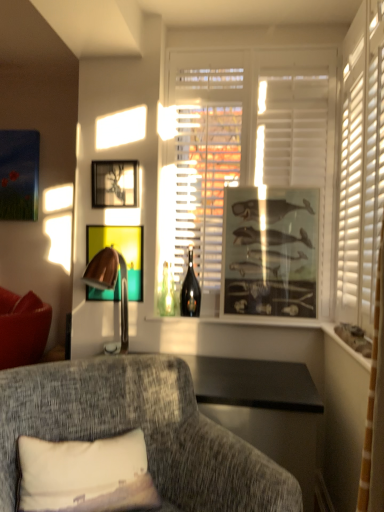
Image resolution: width=384 pixels, height=512 pixels. Find the location of `vacant space that is in between matte glass picture frame at center, the 3th picture frame when ordered from left to right, and shiny dark glass wine bottle at center`. vacant space that is in between matte glass picture frame at center, the 3th picture frame when ordered from left to right, and shiny dark glass wine bottle at center is located at coordinates (248, 321).